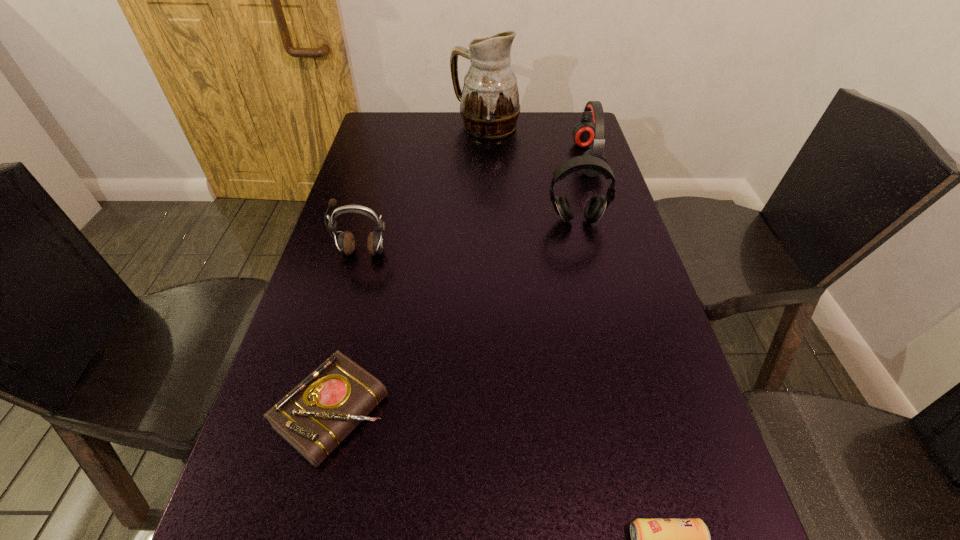
The width and height of the screenshot is (960, 540). Identify the location of vacant area that lies between the fourth nearest object and the farthest earphone. (582, 190).

Find the location of a particular element. the fifth closest object to the fifth nearest object is located at coordinates (651, 539).

Where is `the second closest object to the second nearest earphone`? The image size is (960, 540). the second closest object to the second nearest earphone is located at coordinates (489, 102).

Image resolution: width=960 pixels, height=540 pixels. I want to click on the second closest earphone to the farthest object, so click(x=595, y=207).

Identify the location of earphone object that ranks as the closest to the third object from left to right. The image size is (960, 540). (584, 133).

Identify the location of vacant space that satisfies the following two spatial constraints: 1. from the spout of the pitcher; 2. on the front side of the second shortest object. The height and width of the screenshot is (540, 960). (491, 413).

At what (x,y) coordinates should I click in order to perform the action: click on vacant space that satisfies the following two spatial constraints: 1. from the spout of the tallest object; 2. on the ear pads of the nearest earphone. Please return your answer as a coordinate pair (x, y). Looking at the image, I should click on (488, 252).

Image resolution: width=960 pixels, height=540 pixels. Identify the location of free location that satisfies the following two spatial constraints: 1. on the ear cups of the fifth nearest object; 2. on the ear cups of the second farthest earphone. (606, 220).

You are a GUI agent. You are given a task and a screenshot of the screen. Output one action in this format:
    pyautogui.click(x=<x>, y=<y>)
    Task: Click on the free location that satisfies the following two spatial constraints: 1. on the ear cups of the second farthest object; 2. on the ear cups of the fourth nearest object
    Image resolution: width=960 pixels, height=540 pixels.
    Given the screenshot: What is the action you would take?
    pyautogui.click(x=606, y=220)

Identify the location of vacant space that satisfies the following two spatial constraints: 1. on the ear pads of the diary; 2. on the left side of the nearest earphone. Image resolution: width=960 pixels, height=540 pixels. (318, 413).